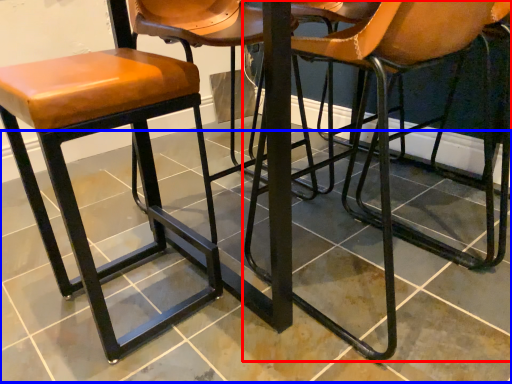
Question: Which object appears farthest to the camera in this image, chair (highlighted by a red box) or tile (highlighted by a blue box)?

Choices:
 (A) chair
 (B) tile

Answer: (A)